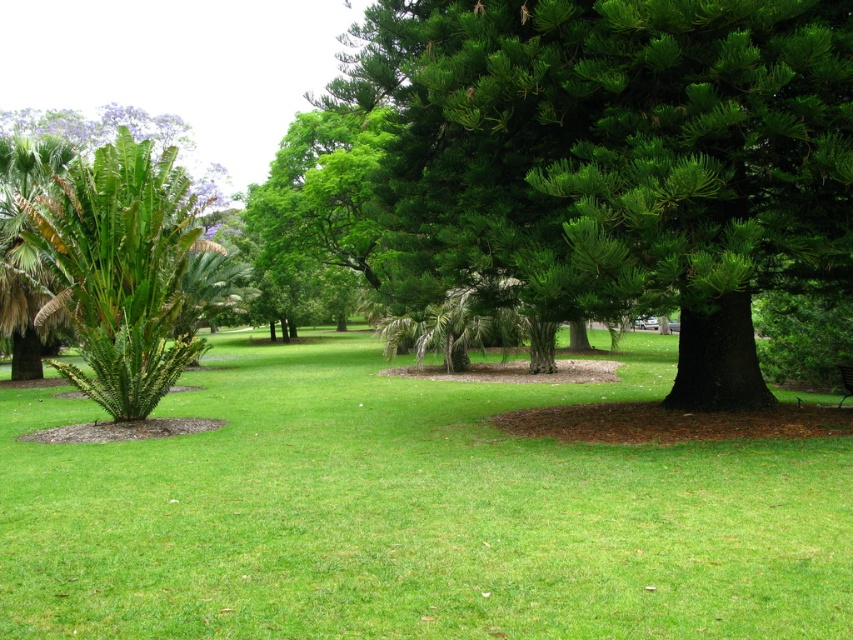
You are standing in the park and want to walk from the point at coordinates point (126, 580) to the point at coordinates point (74, 321). Which point will you reach first?

You will reach the point at coordinates point (126, 580) first because it is closer to you than the point at coordinates point (74, 321).

You are a gardener who wants to plant a new flower bed. You have two spots in mind in the park image shown. One is located where the green grassy at center is, and the other is near the green leafy palm tree at left. Considering the height of the existing plants, which location would allow the flowers to receive more sunlight?

The green grassy at center is not as tall as the green leafy palm tree at left, so planting the flowers at the green grassy at center would allow them to receive more sunlight since the grass is shorter and less likely to block sunlight compared to the taller palm tree.